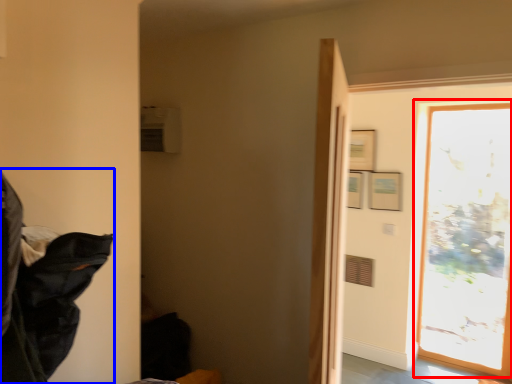
Question: Which object appears closest to the camera in this image, window (highlighted by a red box) or laundry (highlighted by a blue box)?

Choices:
 (A) window
 (B) laundry

Answer: (B)